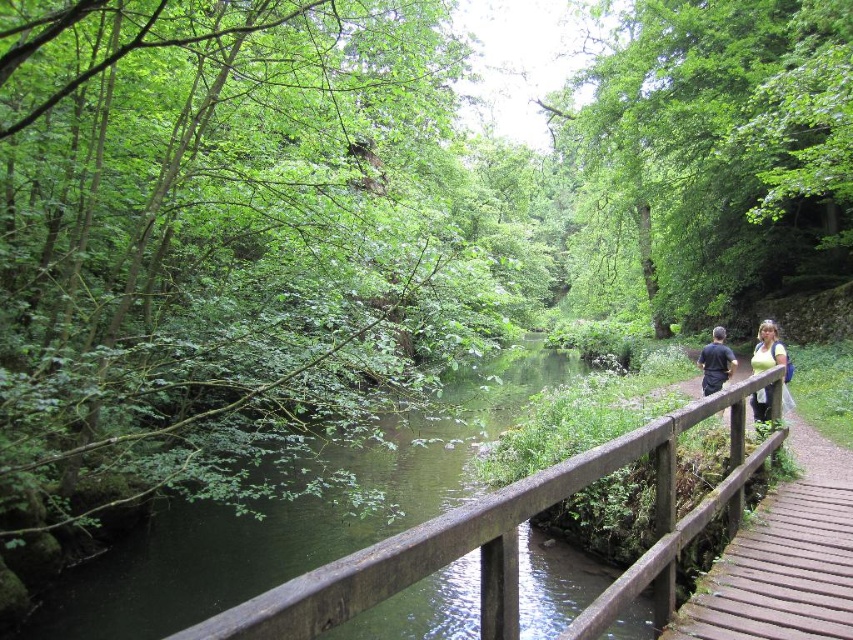
Question: Which object appears farthest from the camera in this image?

Choices:
 (A) green fabric top at upper right
 (B) brown wooden bridge at center

Answer: (A)

Question: Among these objects, which one is farthest from the camera?

Choices:
 (A) green fabric shirt at right
 (B) green fabric top at upper right
 (C) dark blue shirt at center-right
 (D) brown wooden bridge at center

Answer: (C)

Question: Does green fabric shirt at right have a lesser width compared to green fabric top at upper right?

Choices:
 (A) yes
 (B) no

Answer: (B)

Question: Is green fabric top at upper right bigger than dark blue shirt at center-right?

Choices:
 (A) yes
 (B) no

Answer: (A)

Question: Which point is farther from the camera taking this photo?

Choices:
 (A) (701, 358)
 (B) (564, 637)
 (C) (751, 368)

Answer: (C)

Question: Does brown wooden bridge at center appear on the left side of dark blue shirt at center-right?

Choices:
 (A) no
 (B) yes

Answer: (B)